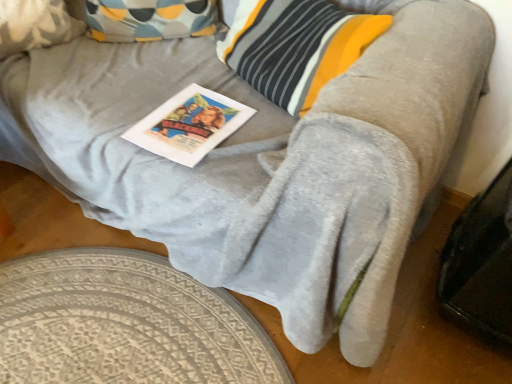
Question: Considering their positions, is white paper magazine at center located in front of or behind fluffy beige pillow at upper left?

Choices:
 (A) behind
 (B) front

Answer: (B)

Question: Looking at the image, does white paper magazine at center seem bigger or smaller compared to fluffy beige pillow at upper left?

Choices:
 (A) small
 (B) big

Answer: (A)

Question: Which object is positioned farthest from the fluffy beige pillow at upper left?

Choices:
 (A) white paper magazine at center
 (B) textured beige rug at lower left

Answer: (B)

Question: Which object is the closest to the fluffy beige pillow at upper left?

Choices:
 (A) white paper magazine at center
 (B) textured beige rug at lower left

Answer: (A)